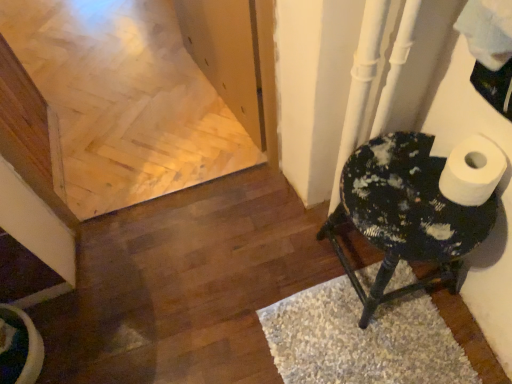
Image resolution: width=512 pixels, height=384 pixels. What are the coordinates of `blank space above speckled black stool at right (from a real-world perspective)` in the screenshot? It's located at (416, 195).